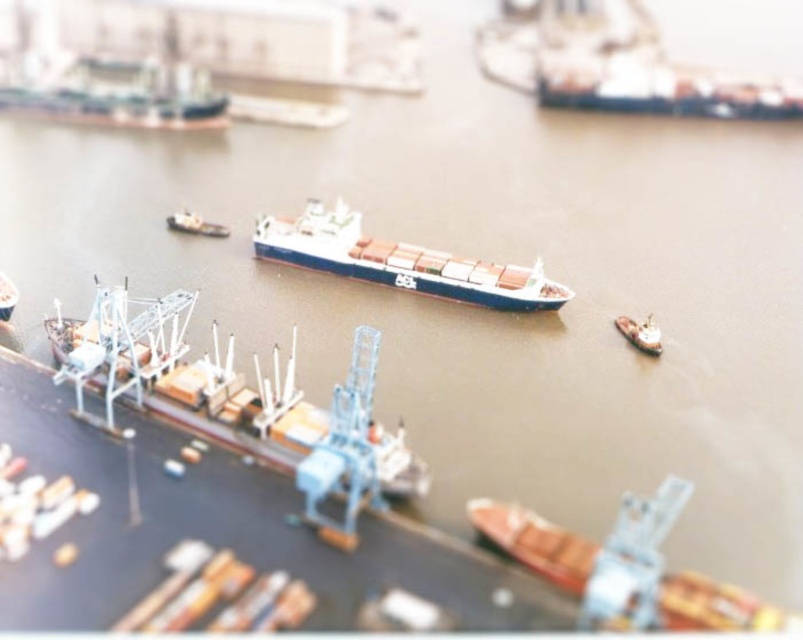
Can you confirm if white matte cargo ship at upper right is thinner than blue matte cargo ship at center?

No.

Based on the photo, is the position of white matte cargo ship at upper right less distant than that of blue matte cargo ship at center?

No, white matte cargo ship at upper right is further to the viewer.

Is point (620, 83) behind point (507, 285)?

Yes, point (620, 83) is behind point (507, 285).

This screenshot has height=640, width=803. I want to click on white matte cargo ship at upper right, so click(618, 65).

Which is more to the left, blue metallic cargo ship at upper left or metallic silver boat at center?

blue metallic cargo ship at upper left is more to the left.

Is blue metallic cargo ship at upper left taller than metallic silver boat at center?

Correct, blue metallic cargo ship at upper left is much taller as metallic silver boat at center.

Who is more distant from viewer, (84, 102) or (168, 225)?

Point (84, 102)

Image resolution: width=803 pixels, height=640 pixels. I want to click on blue metallic cargo ship at upper left, so click(x=121, y=96).

This screenshot has width=803, height=640. Describe the element at coordinates (400, 260) in the screenshot. I see `blue matte cargo ship at center` at that location.

Can you confirm if blue matte cargo ship at center is shorter than blue metallic cargo ship at upper left?

Yes.

Which is behind, point (500, 291) or point (88, 67)?

Positioned behind is point (88, 67).

The image size is (803, 640). What are the coordinates of `blue matte cargo ship at center` in the screenshot? It's located at (400, 260).